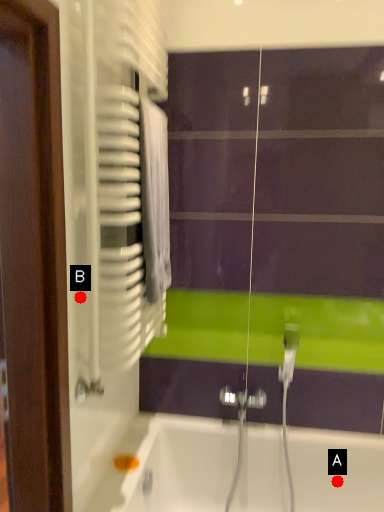
Question: Two points are circled on the image, labeled by A and B beside each circle. Which point appears farthest from the camera in this image?

Choices:
 (A) A is further
 (B) B is further

Answer: (A)